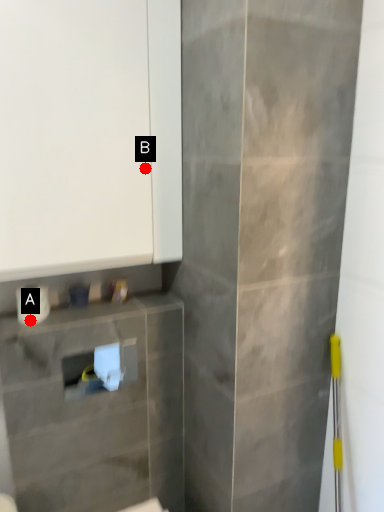
Question: Two points are circled on the image, labeled by A and B beside each circle. Which point is farther from the camera taking this photo?

Choices:
 (A) A is further
 (B) B is further

Answer: (B)